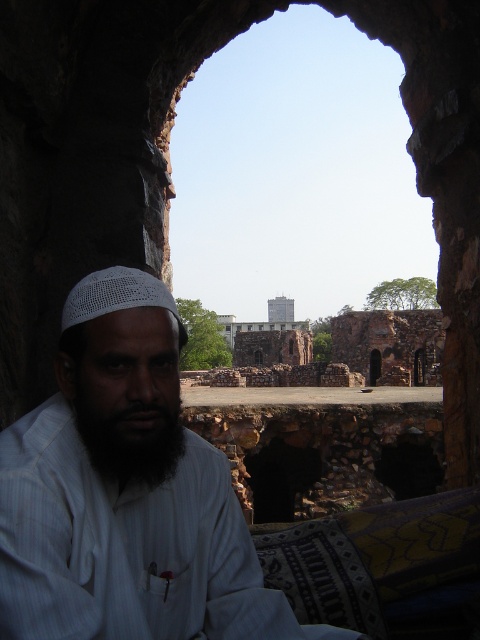
Question: From the image, what is the correct spatial relationship of white clothed man at center in relation to black matte beard at center?

Choices:
 (A) left
 (B) right

Answer: (B)

Question: Which point appears closest to the camera in this image?

Choices:
 (A) (132, 440)
 (B) (233, 554)

Answer: (A)

Question: Which of the following is the closest to the observer?

Choices:
 (A) (178, 458)
 (B) (88, 336)

Answer: (B)

Question: Is white clothed man at center positioned at the back of black matte beard at center?

Choices:
 (A) yes
 (B) no

Answer: (B)

Question: Is white clothed man at center above black matte beard at center?

Choices:
 (A) yes
 (B) no

Answer: (B)